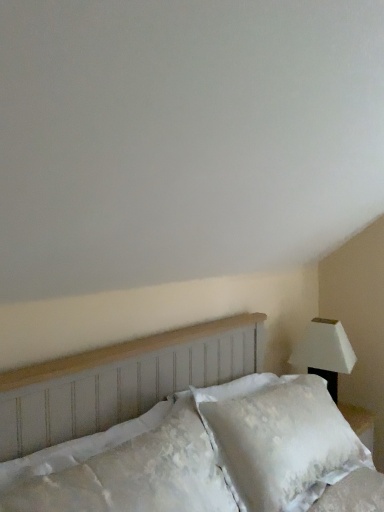
Question: From a real-world perspective, is white matte lamp at right physically above white textured headboard at center?

Choices:
 (A) yes
 (B) no

Answer: (B)

Question: From the image's perspective, is white matte lamp at right below white textured headboard at center?

Choices:
 (A) no
 (B) yes

Answer: (A)

Question: Does white matte lamp at right have a greater width compared to white textured headboard at center?

Choices:
 (A) no
 (B) yes

Answer: (A)

Question: Considering the relative sizes of white matte lamp at right and white textured headboard at center in the image provided, is white matte lamp at right smaller than white textured headboard at center?

Choices:
 (A) yes
 (B) no

Answer: (A)

Question: From the image's perspective, would you say white matte lamp at right is positioned over white textured headboard at center?

Choices:
 (A) yes
 (B) no

Answer: (A)

Question: From a real-world perspective, does white matte lamp at right sit lower than white textured headboard at center?

Choices:
 (A) yes
 (B) no

Answer: (A)

Question: Can you confirm if white textured headboard at center is bigger than white matte lamp at right?

Choices:
 (A) no
 (B) yes

Answer: (B)

Question: From the image's perspective, is white textured headboard at center on white matte lamp at right?

Choices:
 (A) yes
 (B) no

Answer: (B)

Question: From a real-world perspective, is white textured headboard at center on top of white matte lamp at right?

Choices:
 (A) yes
 (B) no

Answer: (A)

Question: Is white textured headboard at center to the left of white matte lamp at right from the viewer's perspective?

Choices:
 (A) no
 (B) yes

Answer: (B)

Question: Can you confirm if white textured headboard at center is positioned to the right of white matte lamp at right?

Choices:
 (A) no
 (B) yes

Answer: (A)

Question: Is white textured headboard at center taller than white matte lamp at right?

Choices:
 (A) no
 (B) yes

Answer: (B)

Question: Is white matte lamp at right wider than white textured pillow at lower left?

Choices:
 (A) yes
 (B) no

Answer: (A)